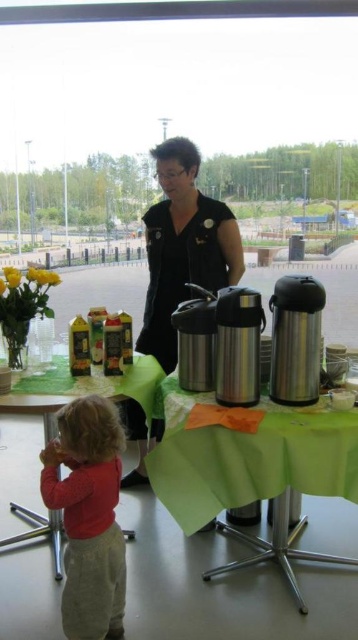
Who is higher up, black fabric at center or green fabric table at lower left?

black fabric at center

Is black fabric at center taller than green fabric table at lower left?

Yes, black fabric at center is taller than green fabric table at lower left.

Between point (160, 180) and point (13, 394), which one is positioned in front?

Positioned in front is point (13, 394).

Locate an element on the screen. The height and width of the screenshot is (640, 358). black fabric at center is located at coordinates (182, 246).

Describe the element at coordinates (89, 515) in the screenshot. I see `matte red shirt at lower left` at that location.

Which is below, matte red shirt at lower left or green fabric table at lower left?

matte red shirt at lower left is lower down.

Is point (51, 483) farther from viewer compared to point (141, 394)?

No, (51, 483) is closer to viewer.

Identify the location of matte red shirt at lower left. (89, 515).

Describe the element at coordinates (250, 465) in the screenshot. The width and height of the screenshot is (358, 640). I see `green fabric table at center` at that location.

Can you confirm if green fabric table at center is positioned to the right of green fabric table at lower left?

Yes, green fabric table at center is to the right of green fabric table at lower left.

Is point (313, 435) closer to camera compared to point (56, 520)?

That is True.

I want to click on green fabric table at center, so click(250, 465).